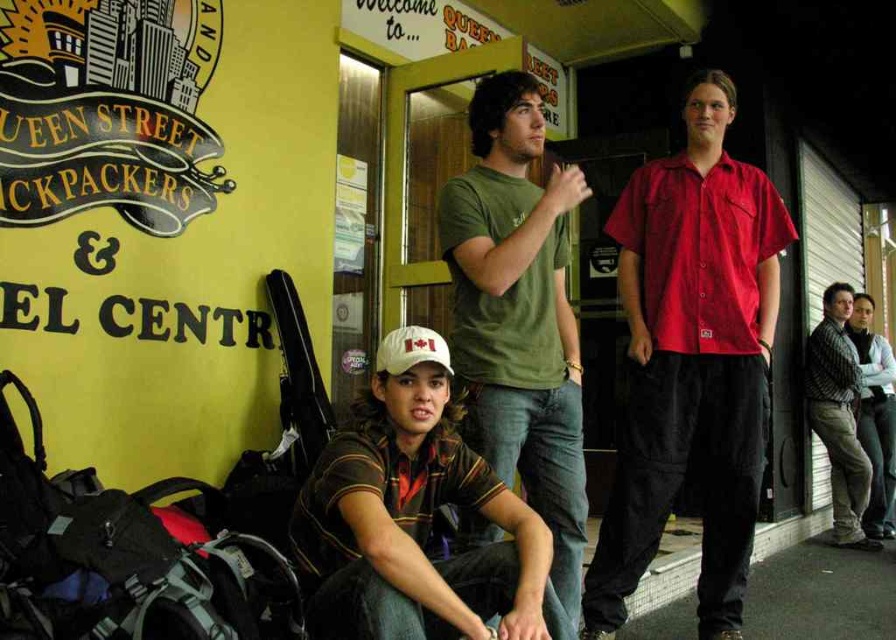
Which is more to the right, green matte t-shirt at center or white fabric baseball cap at center?

green matte t-shirt at center is more to the right.

Is point (540, 396) closer to viewer compared to point (384, 340)?

No, it is not.

At what (x,y) coordinates should I click in order to perform the action: click on green matte t-shirt at center. Please return your answer as a coordinate pair (x, y). The image size is (896, 640). Looking at the image, I should click on (519, 316).

Between red cotton shirt at center and white fabric baseball cap at center, which one has less height?

white fabric baseball cap at center

Does red cotton shirt at center have a larger size compared to white fabric baseball cap at center?

Yes, red cotton shirt at center is bigger than white fabric baseball cap at center.

Is point (745, 330) farther from camera compared to point (414, 340)?

Yes, it is.

Locate an element on the screen. The height and width of the screenshot is (640, 896). red cotton shirt at center is located at coordinates (691, 362).

Measure the distance between point [734,496] and camera.

They are 8.34 feet apart.

Can you confirm if red cotton shirt at center is wider than brown striped shirt at center?

Yes, red cotton shirt at center is wider than brown striped shirt at center.

Who is more forward, (x=696, y=248) or (x=401, y=547)?

Point (x=401, y=547) is in front.

Identify the location of red cotton shirt at center. (691, 362).